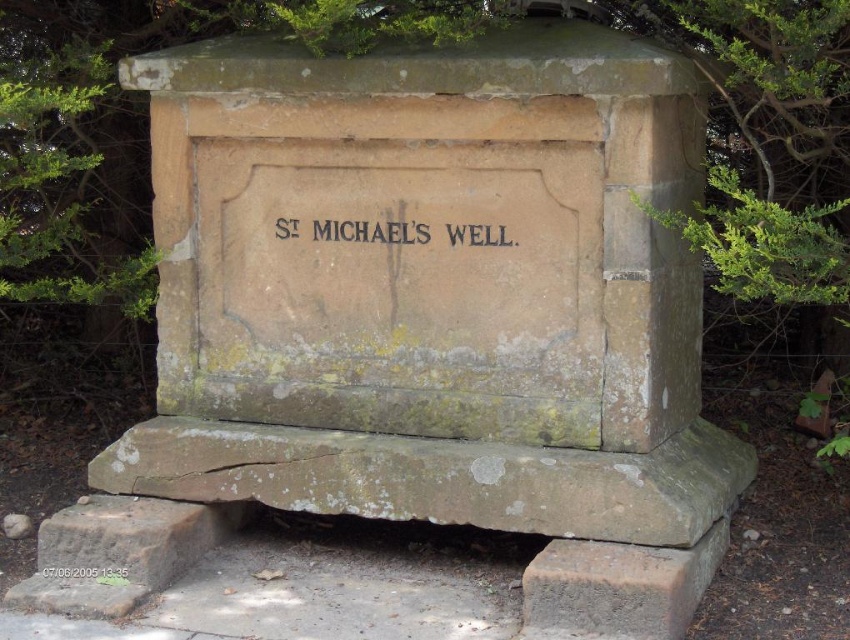
Does black stone engraving at center appear over dark brown stone plaque at center?

Yes.

Does black stone engraving at center appear on the left side of dark brown stone plaque at center?

No, black stone engraving at center is not to the left of dark brown stone plaque at center.

Where is `black stone engraving at center`? Image resolution: width=850 pixels, height=640 pixels. black stone engraving at center is located at coordinates (371, 230).

Who is taller, brown stone monument at center or dark brown stone plaque at center?

Standing taller between the two is brown stone monument at center.

The image size is (850, 640). What do you see at coordinates (431, 289) in the screenshot?
I see `brown stone monument at center` at bounding box center [431, 289].

Locate an element on the screen. The height and width of the screenshot is (640, 850). brown stone monument at center is located at coordinates (431, 289).

Between point (607, 99) and point (477, 228), which one is positioned in front?

Positioned in front is point (607, 99).

Is brown stone monument at center behind black stone engraving at center?

No.

Locate an element on the screen. This screenshot has width=850, height=640. brown stone monument at center is located at coordinates (431, 289).